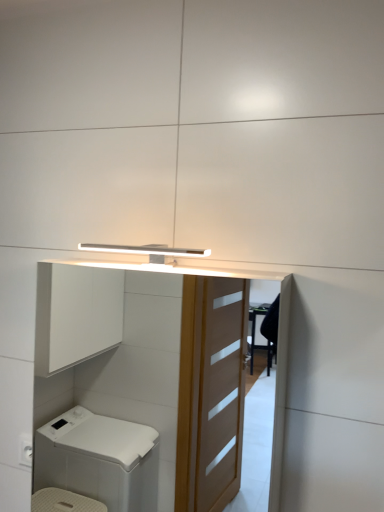
Identify the location of white glossy cabinet at upper center. The height and width of the screenshot is (512, 384). (131, 372).

What do you see at coordinates (131, 372) in the screenshot?
I see `white glossy cabinet at upper center` at bounding box center [131, 372].

I want to click on white glossy cabinet at upper center, so click(x=131, y=372).